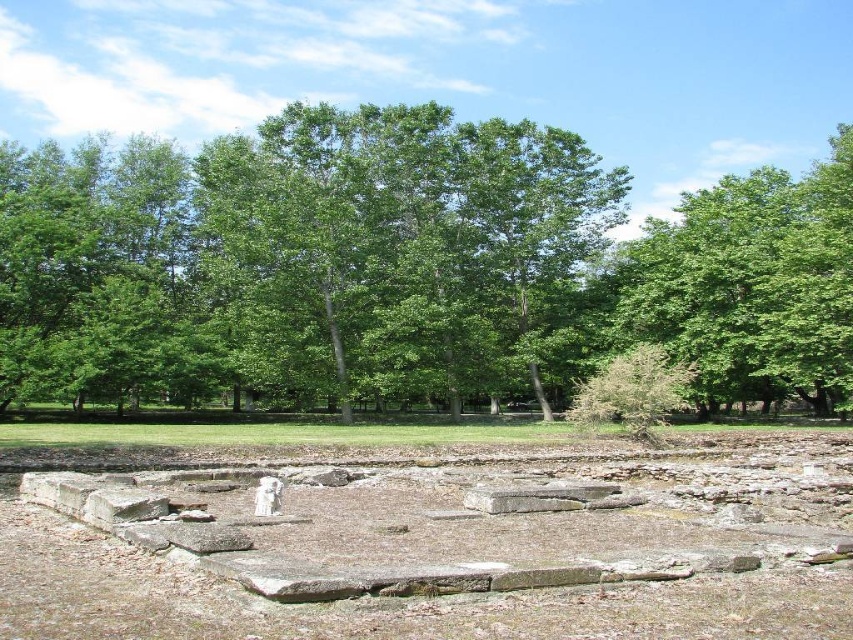
Question: Does green leafy tree at center have a larger size compared to brown stone dirt field at center?

Choices:
 (A) yes
 (B) no

Answer: (A)

Question: Does green leafy tree at center appear over brown stone dirt field at center?

Choices:
 (A) yes
 (B) no

Answer: (A)

Question: Which point is farther to the camera?

Choices:
 (A) (639, 330)
 (B) (196, 582)

Answer: (A)

Question: Can you confirm if green leafy tree at center is positioned below brown stone dirt field at center?

Choices:
 (A) no
 (B) yes

Answer: (A)

Question: Among these objects, which one is nearest to the camera?

Choices:
 (A) green leafy tree at center
 (B) brown stone dirt field at center

Answer: (B)